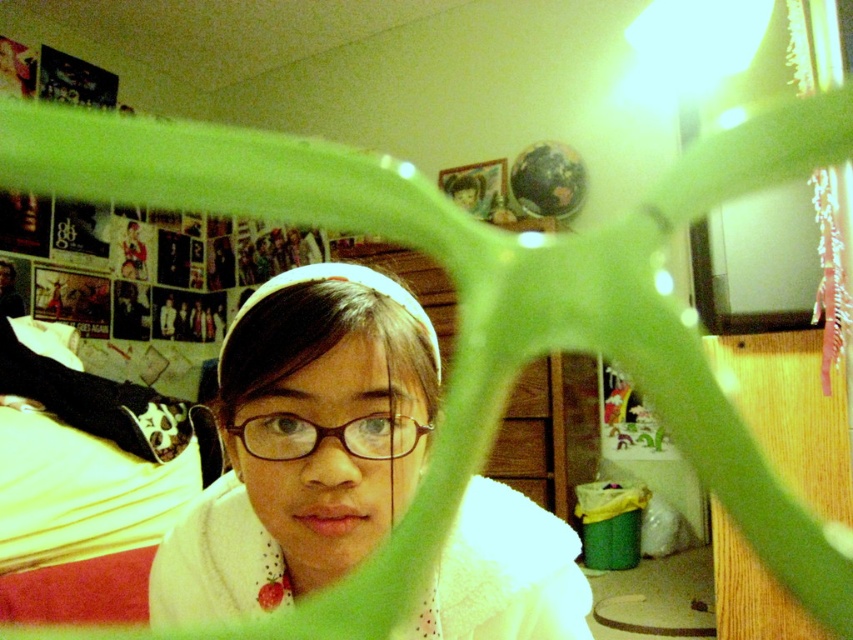
Measure the distance between white fluffy robe at center and camera.

17.00 inches

Is white fluffy robe at center to the left of brown matte glasses at center from the viewer's perspective?

In fact, white fluffy robe at center is to the right of brown matte glasses at center.

Is point (463, 496) closer to camera compared to point (282, 435)?

No.

Locate an element on the screen. Image resolution: width=853 pixels, height=640 pixels. white fluffy robe at center is located at coordinates (303, 444).